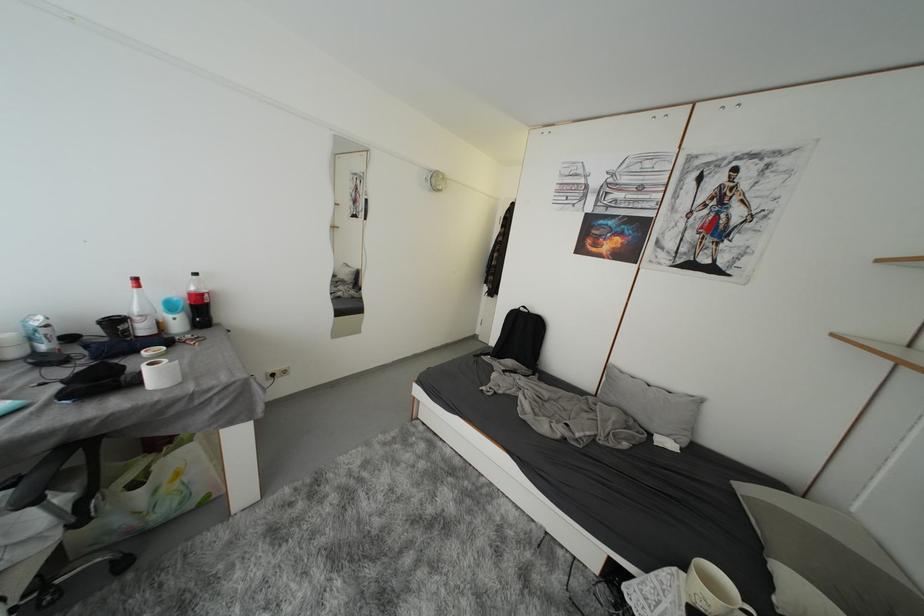
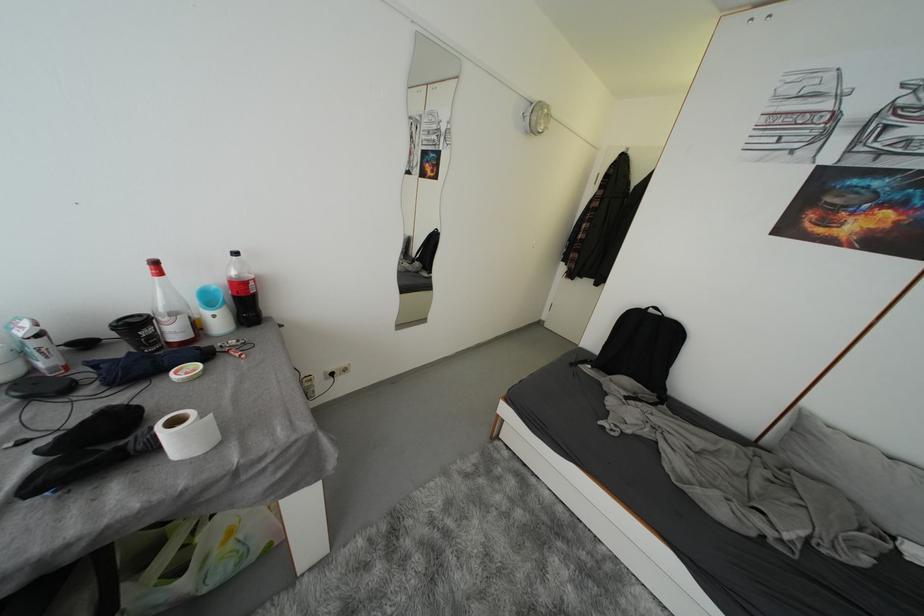
Which direction would the cameraman need to move to produce the second image?

The cameraman walked toward left, forward.